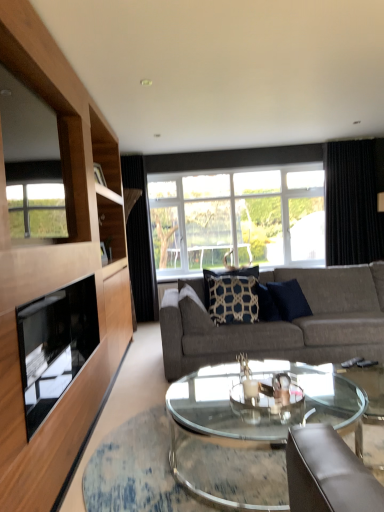
Question: Is black textured curtain at center, placed as the first curtain when sorted from left to right, bigger than navy blue textured pillow at center, which is counted as the second pillow, starting from the right?

Choices:
 (A) yes
 (B) no

Answer: (A)

Question: From the image's perspective, is black textured curtain at center, placed as the first curtain when sorted from left to right, under navy blue textured pillow at center, which is counted as the second pillow, starting from the right?

Choices:
 (A) no
 (B) yes

Answer: (A)

Question: Is black textured curtain at center, which is the second curtain from right to left, aimed at navy blue textured pillow at center, which is counted as the second pillow, starting from the right?

Choices:
 (A) yes
 (B) no

Answer: (B)

Question: Considering the relative positions of black textured curtain at center, which is the second curtain from right to left, and navy blue textured pillow at center, which is counted as the second pillow, starting from the right, in the image provided, is black textured curtain at center, which is the second curtain from right to left, behind navy blue textured pillow at center, which is counted as the second pillow, starting from the right,?

Choices:
 (A) yes
 (B) no

Answer: (A)

Question: Can you confirm if black textured curtain at center, placed as the first curtain when sorted from left to right, is smaller than navy blue textured pillow at center, the first pillow viewed from the left?

Choices:
 (A) yes
 (B) no

Answer: (B)

Question: Which is correct: transparent glass window at center is inside dark blue textured pillow at center, the first pillow when ordered from right to left, or outside of it?

Choices:
 (A) outside
 (B) inside

Answer: (A)

Question: Based on their sizes in the image, would you say transparent glass window at center is bigger or smaller than dark blue textured pillow at center, acting as the second pillow starting from the left?

Choices:
 (A) big
 (B) small

Answer: (A)

Question: Considering the positions of transparent glass window at center and dark blue textured pillow at center, acting as the second pillow starting from the left, in the image, is transparent glass window at center wider or thinner than dark blue textured pillow at center, acting as the second pillow starting from the left,?

Choices:
 (A) thin
 (B) wide

Answer: (A)

Question: From the image's perspective, is transparent glass window at center positioned above or below dark blue textured pillow at center, acting as the second pillow starting from the left?

Choices:
 (A) below
 (B) above

Answer: (B)

Question: From a real-world perspective, is navy blue textured pillow at center, the first pillow viewed from the left, positioned above or below black glass fireplace at left?

Choices:
 (A) below
 (B) above

Answer: (A)

Question: Considering the positions of navy blue textured pillow at center, the first pillow viewed from the left, and black glass fireplace at left in the image, is navy blue textured pillow at center, the first pillow viewed from the left, taller or shorter than black glass fireplace at left?

Choices:
 (A) short
 (B) tall

Answer: (B)

Question: Looking at the image, does navy blue textured pillow at center, which is counted as the second pillow, starting from the right, seem bigger or smaller compared to black glass fireplace at left?

Choices:
 (A) big
 (B) small

Answer: (B)

Question: From the image's perspective, is navy blue textured pillow at center, which is counted as the second pillow, starting from the right, positioned above or below black glass fireplace at left?

Choices:
 (A) below
 (B) above

Answer: (B)

Question: Does point (142, 206) appear closer or farther from the camera than point (329, 375)?

Choices:
 (A) farther
 (B) closer

Answer: (A)

Question: In the image, is black textured curtain at center, placed as the first curtain when sorted from left to right, positioned in front of or behind transparent glass coffee table at center?

Choices:
 (A) behind
 (B) front

Answer: (A)